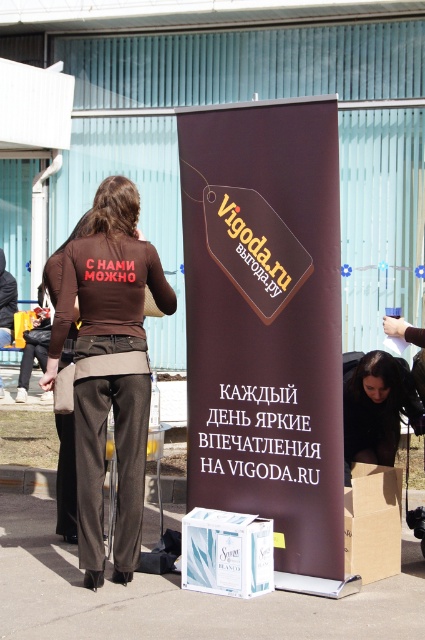
Is point (98, 396) closer to viewer compared to point (353, 502)?

Yes, point (98, 396) is closer to viewer.

Does brown fabric shirt at center have a larger size compared to brown cardboard box at lower right?

Yes.

What do you see at coordinates (108, 368) in the screenshot?
I see `brown fabric shirt at center` at bounding box center [108, 368].

At what (x,y) coordinates should I click in order to perform the action: click on brown fabric shirt at center. Please return your answer as a coordinate pair (x, y). The height and width of the screenshot is (640, 425). Looking at the image, I should click on (108, 368).

Can you confirm if black matte hair at lower center is positioned above brown cardboard box at lower right?

Yes, black matte hair at lower center is above brown cardboard box at lower right.

Is black matte hair at lower center below brown cardboard box at lower right?

Incorrect, black matte hair at lower center is not positioned below brown cardboard box at lower right.

Where is `black matte hair at lower center`? Image resolution: width=425 pixels, height=640 pixels. black matte hair at lower center is located at coordinates (376, 406).

Is point (127, 394) positioned behind point (215, 528)?

Yes, it is behind point (215, 528).

Image resolution: width=425 pixels, height=640 pixels. I want to click on brown fabric shirt at center, so click(108, 368).

What do you see at coordinates (108, 368) in the screenshot? Image resolution: width=425 pixels, height=640 pixels. I see `brown fabric shirt at center` at bounding box center [108, 368].

Locate an element on the screen. brown fabric shirt at center is located at coordinates (108, 368).